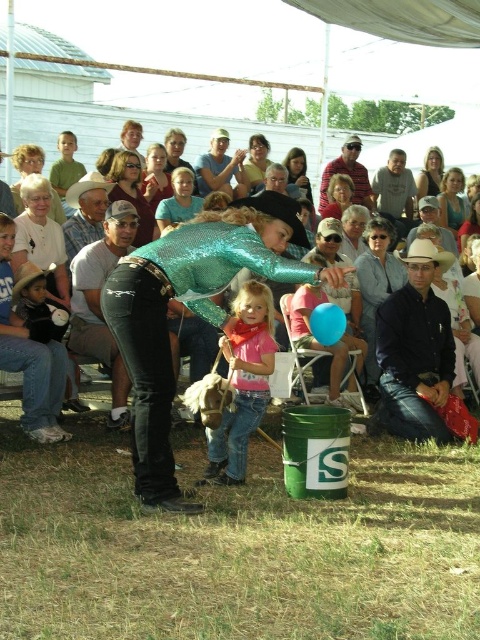
You are standing at the entrance of the tent and want to walk towards the two points marked in the image. Which point, point (277, 243) or point (365, 278), will you reach first?

Point (277, 243) is closer to the viewer than point (365, 278), so you will reach point (277, 243) first.

You are at a fair and see two shirts displayed on stands in the center of the image. The shiny teal shirt at center and the striped cotton shirt at center. Which shirt is closer to the ground?

The shiny teal shirt at center is positioned under the striped cotton shirt at center, so it is closer to the ground.